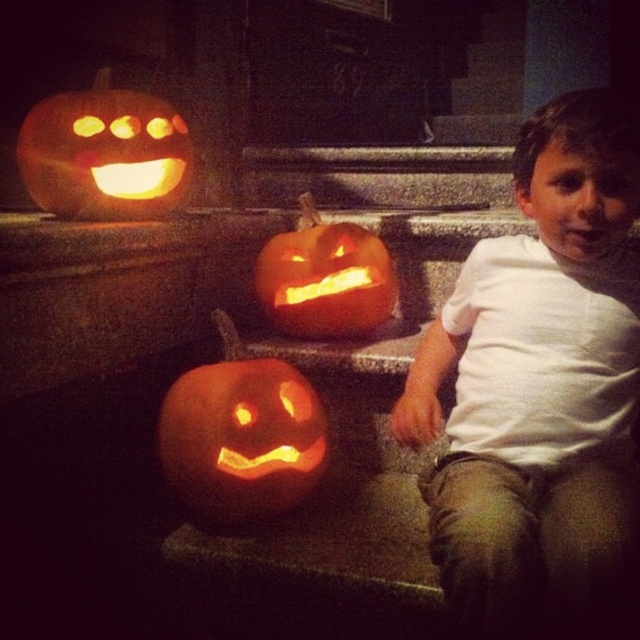
Question: Is white cotton shirt at center to the left of orange matte pumpkin at center from the viewer's perspective?

Choices:
 (A) yes
 (B) no

Answer: (B)

Question: Estimate the real-world distances between objects in this image. Which object is farther from the matte orange pumpkin at upper left?

Choices:
 (A) orange matte pumpkin at center
 (B) white cotton shirt at center
 (C) carved orange pumpkin at center

Answer: (B)

Question: Considering the relative positions of matte orange pumpkin at upper left and orange matte pumpkin at center in the image provided, where is matte orange pumpkin at upper left located with respect to orange matte pumpkin at center?

Choices:
 (A) left
 (B) right

Answer: (A)

Question: Does white cotton shirt at center appear over matte orange pumpkin at upper left?

Choices:
 (A) yes
 (B) no

Answer: (B)

Question: Which point is farther to the camera?

Choices:
 (A) matte orange pumpkin at upper left
 (B) orange matte pumpkin at center

Answer: (B)

Question: Which of the following is the closest to the observer?

Choices:
 (A) orange matte pumpkin at center
 (B) carved orange pumpkin at center
 (C) matte orange pumpkin at upper left

Answer: (B)